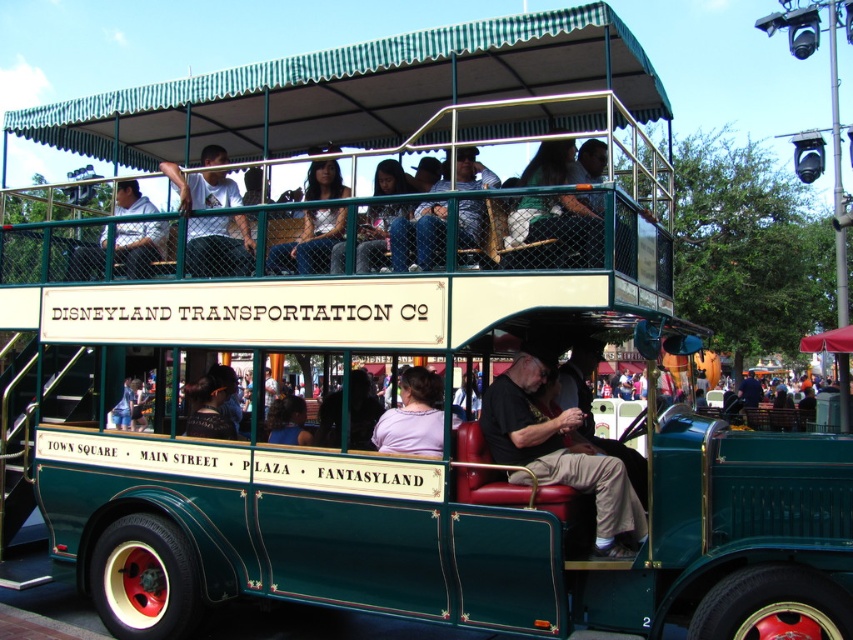
Can you confirm if leather seat at center is shorter than matte silver jacket at center?

No, leather seat at center is not shorter than matte silver jacket at center.

Is point (498, 442) positioned after point (277, 253)?

No, (498, 442) is closer to viewer.

The image size is (853, 640). What do you see at coordinates (558, 452) in the screenshot? I see `leather seat at center` at bounding box center [558, 452].

Identify the location of leather seat at center. This screenshot has width=853, height=640. (558, 452).